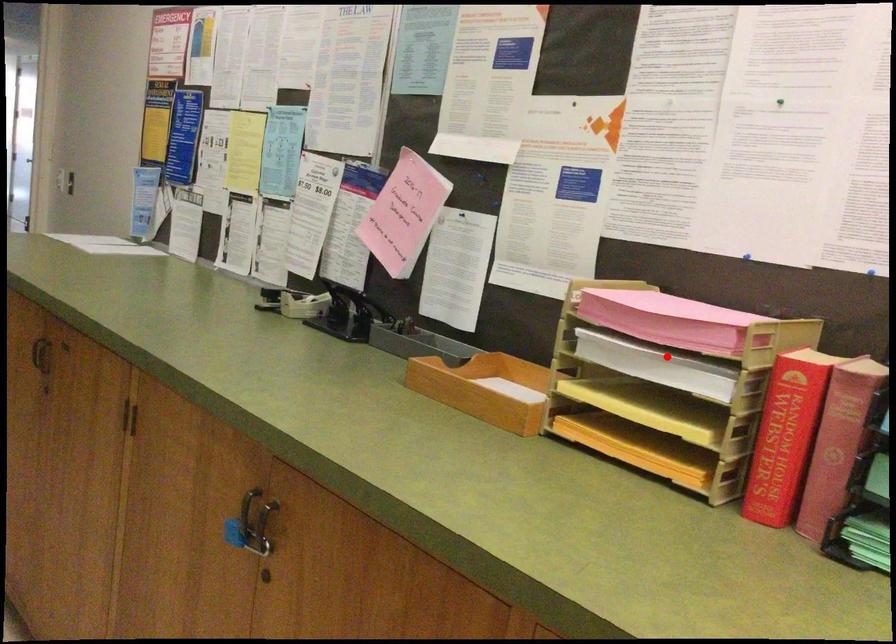
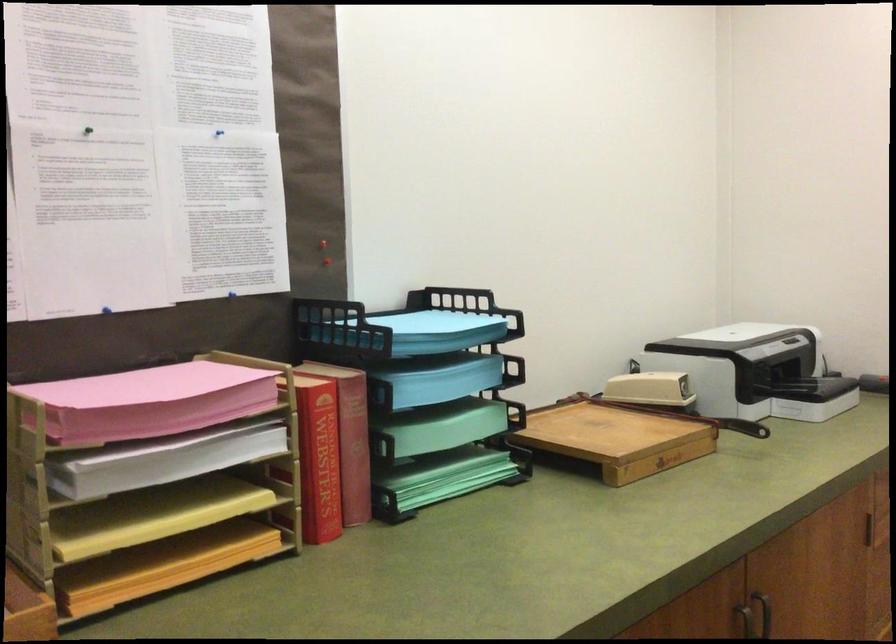
Question: I am providing you with two images of the same scene from different viewpoints. Image1 has a red point marked. In image2, the corresponding 3D location appears at what relative position? Reply with the corresponding letter.

Choices:
 (A) Closer
 (B) Farther

Answer: (A)